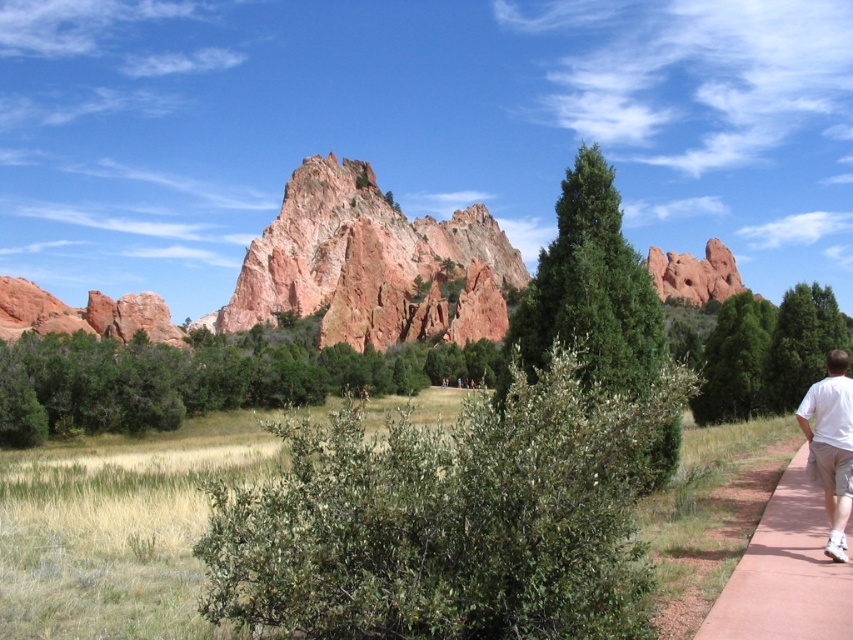
Measure the distance from green textured pine at center to green textured tree at center.

green textured pine at center and green textured tree at center are 109.25 feet apart from each other.

Which is more to the left, green textured pine at center or green textured tree at center?

green textured pine at center

Which is behind, point (602, 168) or point (798, 390)?

Positioned behind is point (798, 390).

You are a GUI agent. You are given a task and a screenshot of the screen. Output one action in this format:
    pyautogui.click(x=<x>, y=<y>)
    Task: Click on the green textured pine at center
    
    Given the screenshot: What is the action you would take?
    pyautogui.click(x=590, y=288)

Can you confirm if rustic sandstone rock formation at center is positioned below green leafy tree at center?

No.

Is rustic sandstone rock formation at center further to the viewer compared to green leafy tree at center?

Yes, rustic sandstone rock formation at center is further from the viewer.

At what (x,y) coordinates should I click in order to perform the action: click on rustic sandstone rock formation at center. Please return your answer as a coordinate pair (x, y). The width and height of the screenshot is (853, 640). Looking at the image, I should click on (372, 266).

Between green textured pine at center and white cotton shirt at right, which one appears on the right side from the viewer's perspective?

white cotton shirt at right is more to the right.

Which is below, green textured pine at center or white cotton shirt at right?

white cotton shirt at right is lower down.

What do you see at coordinates (590, 288) in the screenshot? I see `green textured pine at center` at bounding box center [590, 288].

You are a GUI agent. You are given a task and a screenshot of the screen. Output one action in this format:
    pyautogui.click(x=<x>, y=<y>)
    Task: Click on the green textured pine at center
    This screenshot has width=853, height=640.
    Given the screenshot: What is the action you would take?
    pyautogui.click(x=590, y=288)